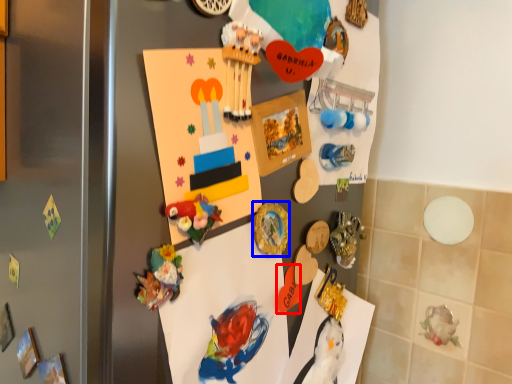
Question: Which point is further to the camera, toy (highlighted by a red box) or button (highlighted by a blue box)?

Choices:
 (A) toy
 (B) button

Answer: (A)